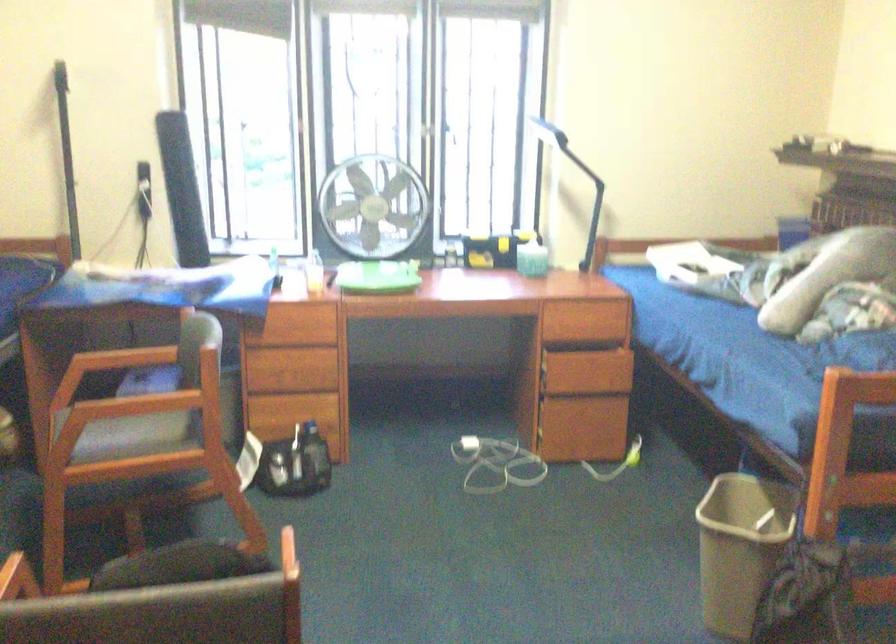
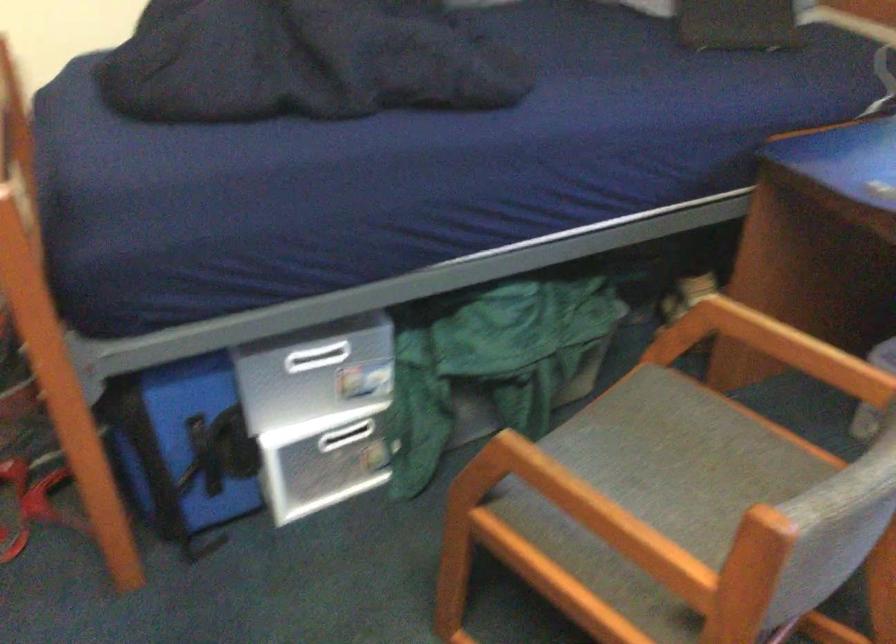
Find the pixel in the second image that matches (x=134, y=406) in the first image.

(597, 514)